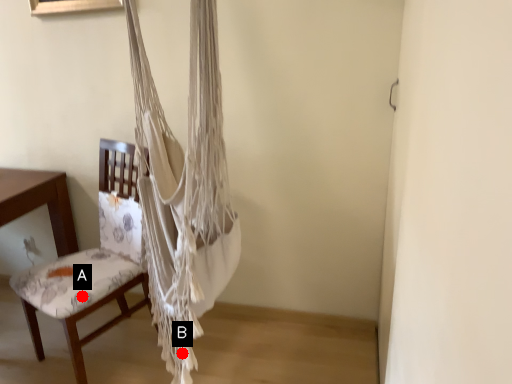
Question: Two points are circled on the image, labeled by A and B beside each circle. Among these points, which one is farthest from the camera?

Choices:
 (A) A is further
 (B) B is further

Answer: (A)